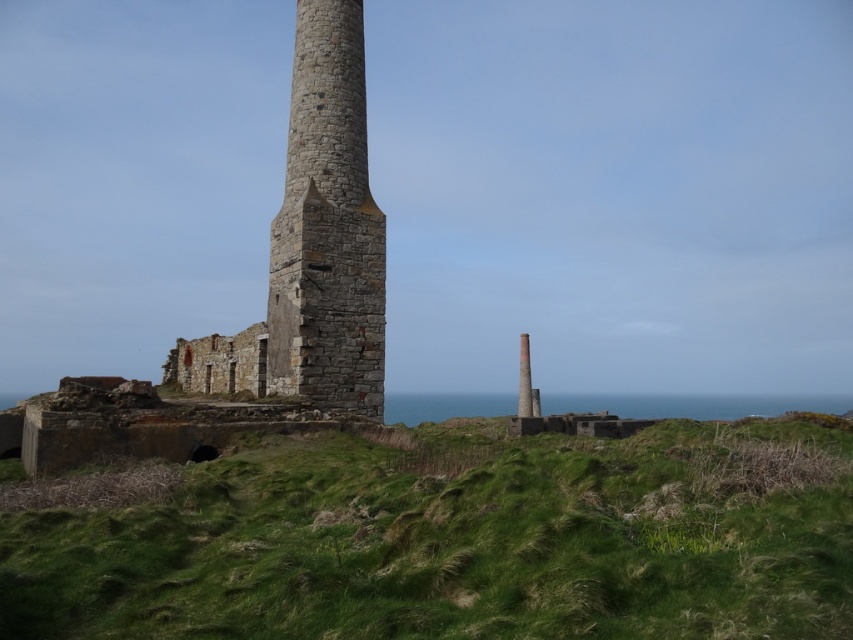
Question: Can you confirm if green grassy at center is thinner than rustic stone tower at center?

Choices:
 (A) no
 (B) yes

Answer: (A)

Question: Is green grassy at center closer to the viewer compared to rustic stone tower at center?

Choices:
 (A) yes
 (B) no

Answer: (A)

Question: Which point is farther from the camera taking this photo?

Choices:
 (A) (358, 77)
 (B) (654, 445)

Answer: (A)

Question: Does green grassy at center appear on the right side of rustic stone tower at center?

Choices:
 (A) yes
 (B) no

Answer: (A)

Question: Which object is closer to the camera taking this photo?

Choices:
 (A) green grassy at center
 (B) rustic stone tower at center

Answer: (A)